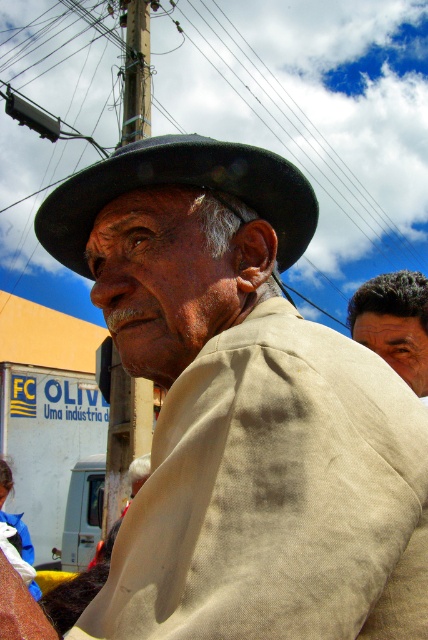
You are an electrician assessing the electrical setup in the image. You notice the black wire at upper center and the brown wooden pole at upper center. Which object is located above the other?

The black wire at upper center is positioned over the brown wooden pole at upper center, so the black wire is above the brown wooden pole.